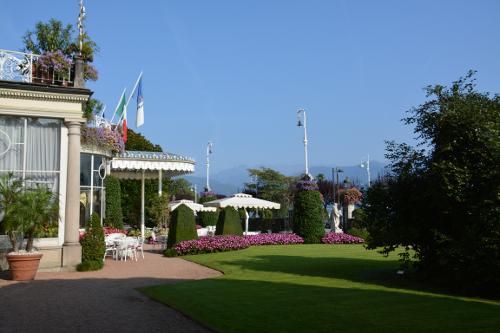
Identify the location of potted plant. The image size is (500, 333). (18, 263).